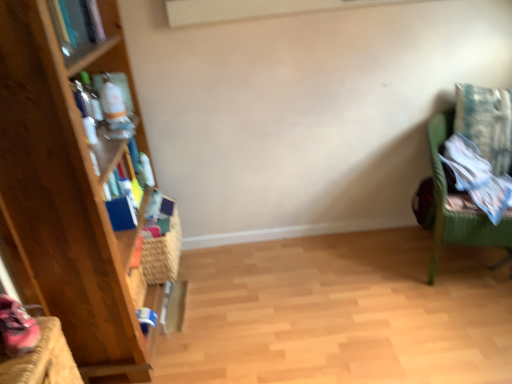
Find the location of a particular element. This screenshot has width=512, height=384. free spot in front of green wicker chair at right is located at coordinates (468, 322).